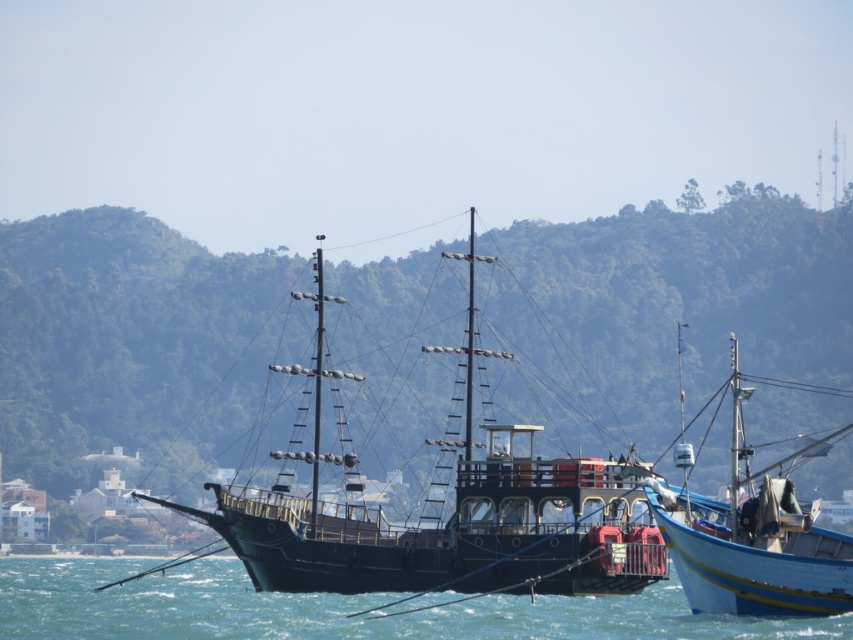
Is point (335, 579) farther from camera compared to point (757, 611)?

Yes, it is behind point (757, 611).

Which is below, wooden pirate ship at center or blue painted wooden boat at right?

blue painted wooden boat at right is lower down.

Between point (512, 442) and point (715, 589), which one is positioned in front?

Point (715, 589)

I want to click on wooden pirate ship at center, so click(451, 513).

Which is above, blue water at center or blue painted wooden boat at right?

Positioned higher is blue painted wooden boat at right.

Who is more distant from viewer, (x=13, y=634) or (x=730, y=588)?

Point (x=13, y=634)

The height and width of the screenshot is (640, 853). Find the location of `blue water at center`. blue water at center is located at coordinates (334, 609).

How much distance is there between wooden pirate ship at center and blue water at center?

They are 13.54 meters apart.

Who is more forward, (605,586) or (503,616)?

Point (503,616) is in front.

The image size is (853, 640). I want to click on wooden pirate ship at center, so click(451, 513).

Find the location of a particular element. Image resolution: width=853 pixels, height=640 pixels. wooden pirate ship at center is located at coordinates (451, 513).